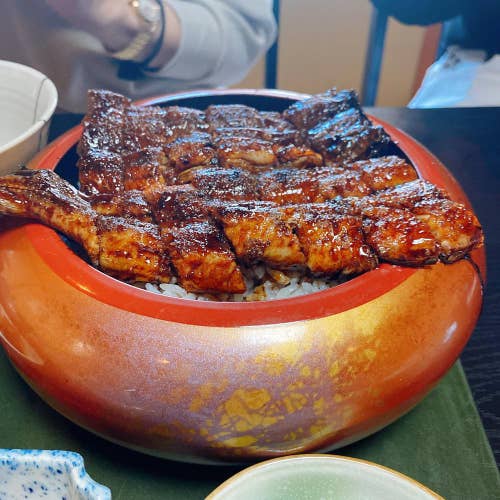
What are the coordinates of `orange bowl` in the screenshot? It's located at (73, 352).